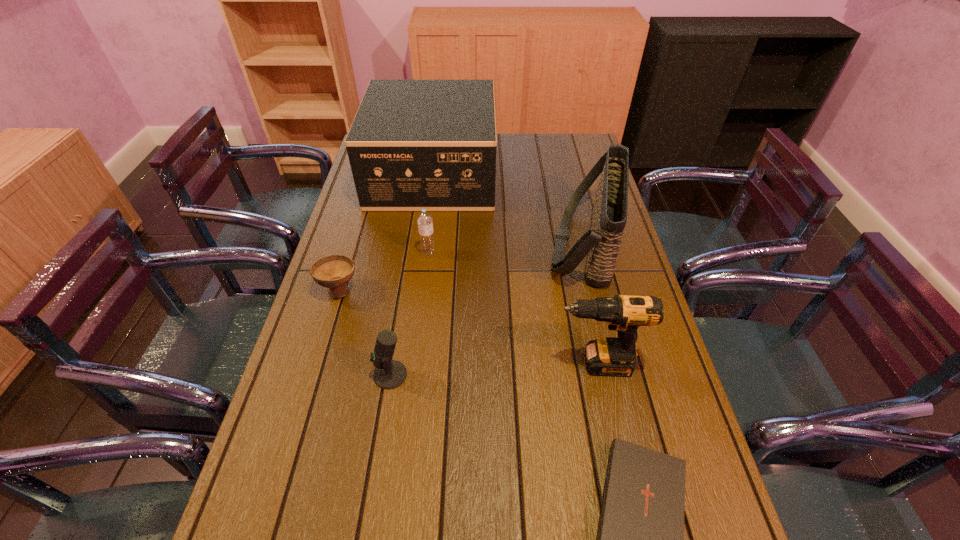
This screenshot has width=960, height=540. Identify the location of free space in the image that satisfies the following two spatial constraints: 1. on the front-facing side of the box; 2. on the left side of the water bottle. (422, 253).

The height and width of the screenshot is (540, 960). Find the location of `blank area in the image that satisfies the following two spatial constraints: 1. on the front-facing side of the handbag; 2. on the right side of the box`. blank area in the image that satisfies the following two spatial constraints: 1. on the front-facing side of the handbag; 2. on the right side of the box is located at coordinates (423, 243).